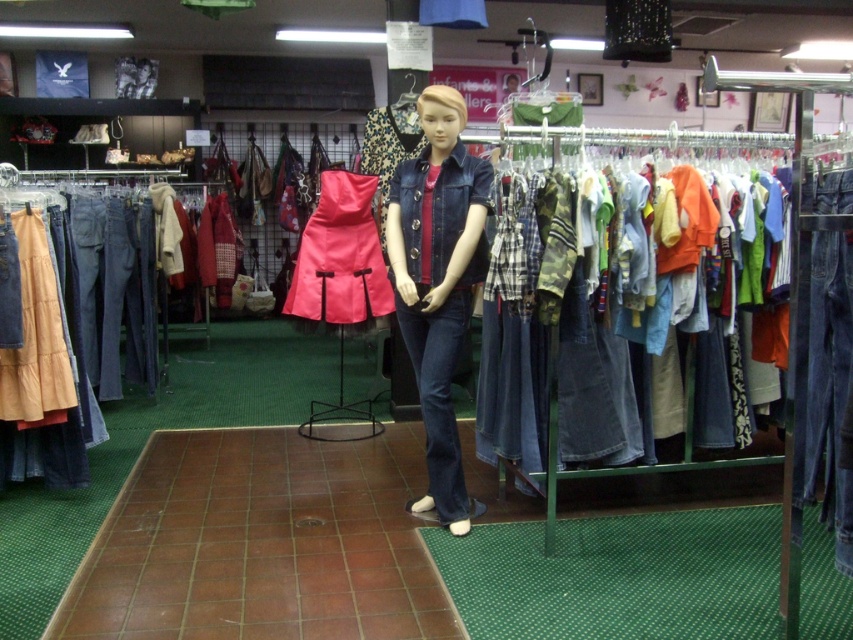
Between denim shirts at center and denim skirt at left, which one appears on the left side from the viewer's perspective?

denim skirt at left

At what (x,y) coordinates should I click in order to perform the action: click on denim shirts at center. Please return your answer as a coordinate pair (x, y). The height and width of the screenshot is (640, 853). Looking at the image, I should click on (611, 336).

Does point (639, 403) lie in front of point (3, 422)?

Yes.

Locate an element on the screen. This screenshot has height=640, width=853. denim shirts at center is located at coordinates (611, 336).

Who is higher up, denim jacket at center or matte pink fabric dress at center?

Positioned higher is matte pink fabric dress at center.

Who is positioned more to the right, denim jacket at center or matte pink fabric dress at center?

denim jacket at center

Where is `denim jacket at center`? Image resolution: width=853 pixels, height=640 pixels. denim jacket at center is located at coordinates (438, 282).

Is denim jacket at center smaller than denim skirt at left?

Yes.

Who is more distant from viewer, [453,292] or [70,332]?

The point [70,332] is behind.

Who is more forward, [457,492] or [76,483]?

Point [457,492] is in front.

The height and width of the screenshot is (640, 853). Find the location of `denim jacket at center`. denim jacket at center is located at coordinates (438, 282).